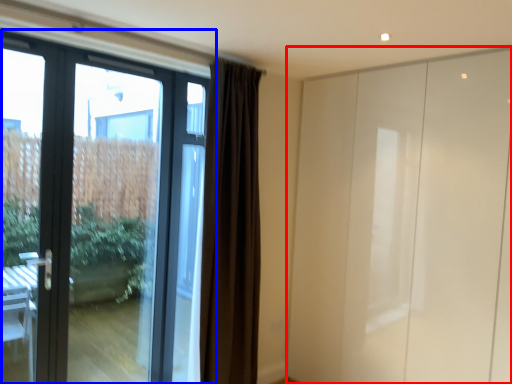
Question: Among these objects, which one is nearest to the camera, screen door (highlighted by a red box) or door (highlighted by a blue box)?

Choices:
 (A) screen door
 (B) door

Answer: (B)